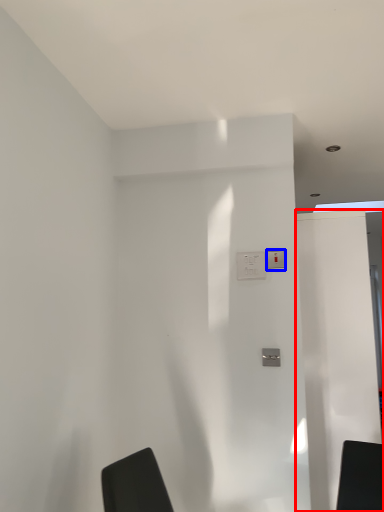
Question: Which object appears farthest to the camera in this image, screen door (highlighted by a red box) or light switch (highlighted by a blue box)?

Choices:
 (A) screen door
 (B) light switch

Answer: (A)